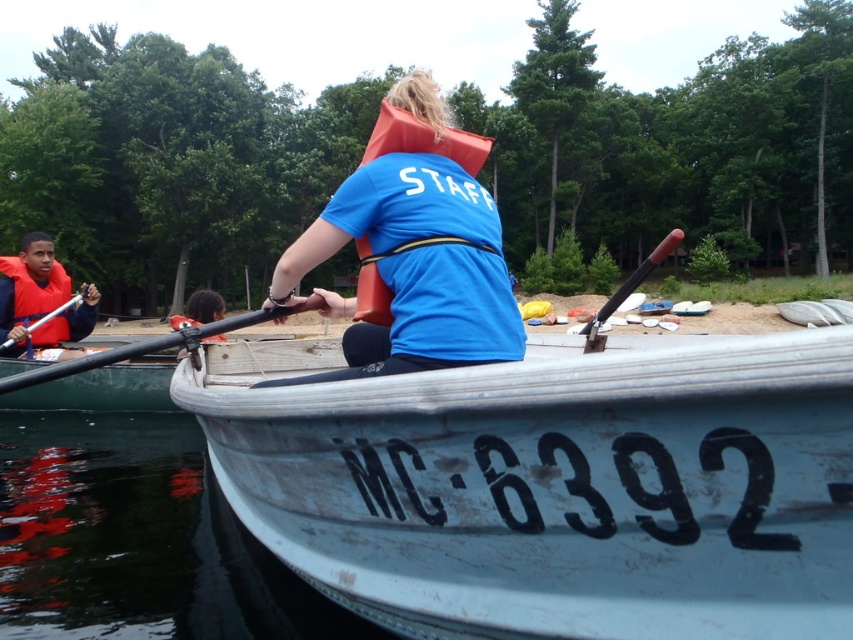
Does black rubber paddle at center have a greater width compared to matte orange life jacket at center?

No.

Is point (167, 336) positioned after point (190, 324)?

No, it is not.

In order to click on black rubber paddle at center in this screenshot , I will do `click(143, 348)`.

Between white weathered wood boat at center and matte orange life vest at center, which one is positioned lower?

Positioned lower is white weathered wood boat at center.

Who is more forward, (x=752, y=392) or (x=194, y=307)?

Point (x=752, y=392) is more forward.

This screenshot has width=853, height=640. What do you see at coordinates (552, 484) in the screenshot?
I see `white weathered wood boat at center` at bounding box center [552, 484].

Image resolution: width=853 pixels, height=640 pixels. Find the location of `white weathered wood boat at center`. white weathered wood boat at center is located at coordinates (552, 484).

Is point (380, 280) closer to viewer compared to point (20, 346)?

Yes.

Is orange foam life jacket at center thinner than matte orange life jacket at left?

No, orange foam life jacket at center is not thinner than matte orange life jacket at left.

Identify the location of orange foam life jacket at center. The image size is (853, 640). (424, 140).